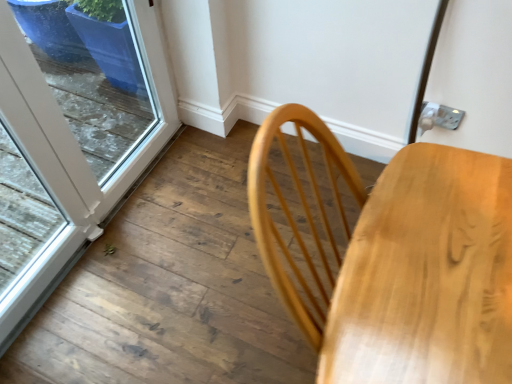
This screenshot has width=512, height=384. Find the location of `white glossy door at lower left`. white glossy door at lower left is located at coordinates (74, 149).

The width and height of the screenshot is (512, 384). What do you see at coordinates (74, 149) in the screenshot? I see `white glossy door at lower left` at bounding box center [74, 149].

Image resolution: width=512 pixels, height=384 pixels. I want to click on white glossy door at lower left, so click(x=74, y=149).